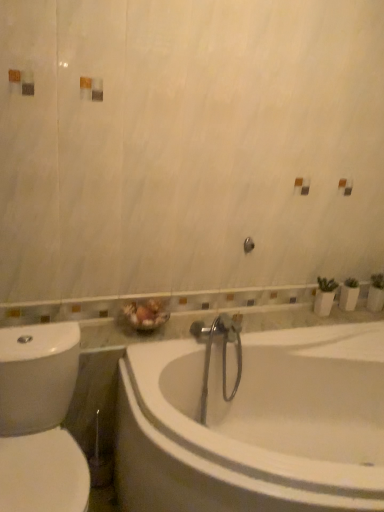
Question: Should I look upward or downward to see white glossy toilet at left?

Choices:
 (A) up
 (B) down

Answer: (B)

Question: Is white glossy bathtub at center next to white glossy toilet at left and touching it?

Choices:
 (A) yes
 (B) no

Answer: (B)

Question: From the image's perspective, is white glossy bathtub at center located above white glossy toilet at left?

Choices:
 (A) no
 (B) yes

Answer: (A)

Question: Is white glossy bathtub at center outside of white glossy toilet at left?

Choices:
 (A) yes
 (B) no

Answer: (A)

Question: From a real-world perspective, is white glossy bathtub at center over white glossy toilet at left?

Choices:
 (A) no
 (B) yes

Answer: (A)

Question: From the image's perspective, is white glossy bathtub at center located beneath white glossy toilet at left?

Choices:
 (A) yes
 (B) no

Answer: (A)

Question: Is the position of white glossy bathtub at center less distant than that of white glossy toilet at left?

Choices:
 (A) no
 (B) yes

Answer: (B)

Question: Are white glossy toilet at left and white glossy bathtub at center located far from each other?

Choices:
 (A) yes
 (B) no

Answer: (B)

Question: Is white glossy toilet at left in contact with white glossy bathtub at center?

Choices:
 (A) no
 (B) yes

Answer: (A)

Question: Can you confirm if white glossy toilet at left is taller than white glossy bathtub at center?

Choices:
 (A) yes
 (B) no

Answer: (A)

Question: Is white glossy toilet at left turned away from white glossy bathtub at center?

Choices:
 (A) yes
 (B) no

Answer: (B)

Question: Does white glossy toilet at left lie behind white glossy bathtub at center?

Choices:
 (A) no
 (B) yes

Answer: (B)

Question: Is white glossy toilet at left thinner than white glossy bathtub at center?

Choices:
 (A) yes
 (B) no

Answer: (A)

Question: In the image, is white glossy bathtub at center on the left side or the right side of white glossy toilet at left?

Choices:
 (A) left
 (B) right

Answer: (B)